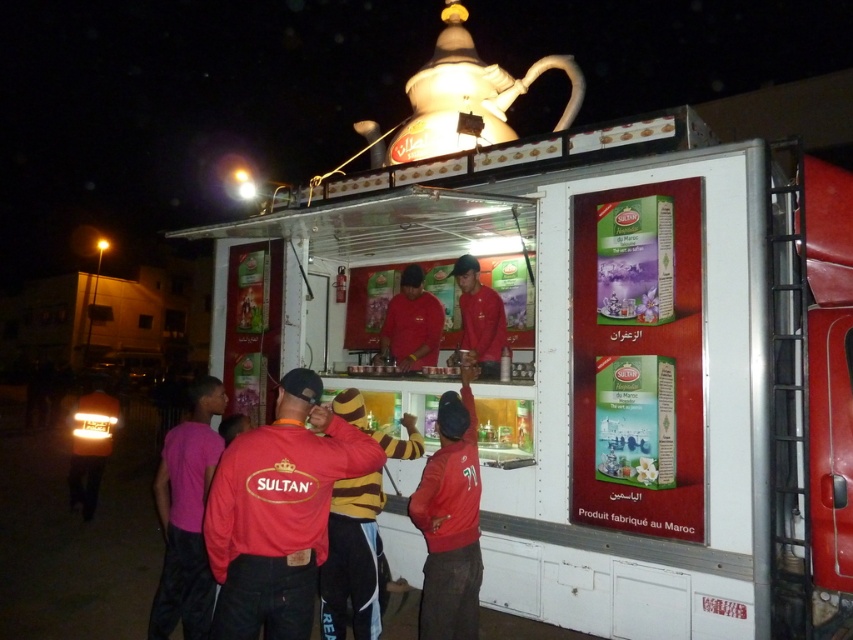
Which is more to the right, white plastic trailer truck at center or red matte uniform at center?

Positioned to the right is white plastic trailer truck at center.

Is point (352, 180) less distant than point (427, 317)?

Yes, point (352, 180) is closer to viewer.

Locate an element on the screen. The image size is (853, 640). white plastic trailer truck at center is located at coordinates (612, 368).

How far apart are red matte jacket at center and white matte teapot at upper center?

They are 3.36 meters apart.

Which of these two, red matte jacket at center or white matte teapot at upper center, stands taller?

white matte teapot at upper center

Does point (310, 381) lie in front of point (535, 65)?

Yes, it is.

Image resolution: width=853 pixels, height=640 pixels. I want to click on red matte jacket at center, so [277, 512].

Does matte red jacket at center appear on the right side of red matte uniform at center?

Indeed, matte red jacket at center is positioned on the right side of red matte uniform at center.

Is matte red jacket at center bigger than red matte uniform at center?

Indeed, matte red jacket at center has a larger size compared to red matte uniform at center.

Where is `matte red jacket at center`? The width and height of the screenshot is (853, 640). matte red jacket at center is located at coordinates (450, 522).